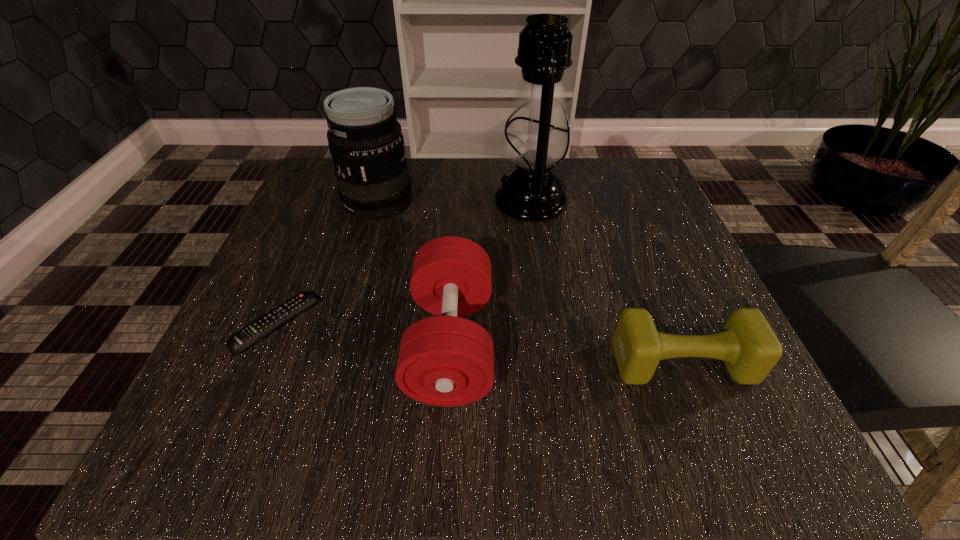
Locate an element on the screen. The image size is (960, 540). vacant point located between the rightmost object and the second object from right to left is located at coordinates (606, 282).

At what (x,y) coordinates should I click in order to perform the action: click on vacant area between the telephoto lens and the right dumbbell. Please return your answer as a coordinate pair (x, y). Image resolution: width=960 pixels, height=540 pixels. Looking at the image, I should click on (530, 283).

Locate an element on the screen. The width and height of the screenshot is (960, 540). free point between the third tallest object and the rightmost object is located at coordinates (566, 354).

Identify the location of free space between the shortest object and the left dumbbell. Image resolution: width=960 pixels, height=540 pixels. click(364, 334).

The height and width of the screenshot is (540, 960). I want to click on object that can be found as the fourth closest to the right dumbbell, so click(255, 331).

Select which object is the closest to the shortest object. Please provide its 2D coordinates. Your answer should be formatted as a tuple, i.e. [(x, y)], where the tuple contains the x and y coordinates of a point satisfying the conditions above.

[(445, 360)]

You are a GUI agent. You are given a task and a screenshot of the screen. Output one action in this format:
    pyautogui.click(x=<x>, y=<y>)
    Task: Click on the vacant space that satisfies the following two spatial constraints: 1. on the front side of the rightmost object; 2. on the right side of the remote control
    The height and width of the screenshot is (540, 960).
    Given the screenshot: What is the action you would take?
    click(259, 363)